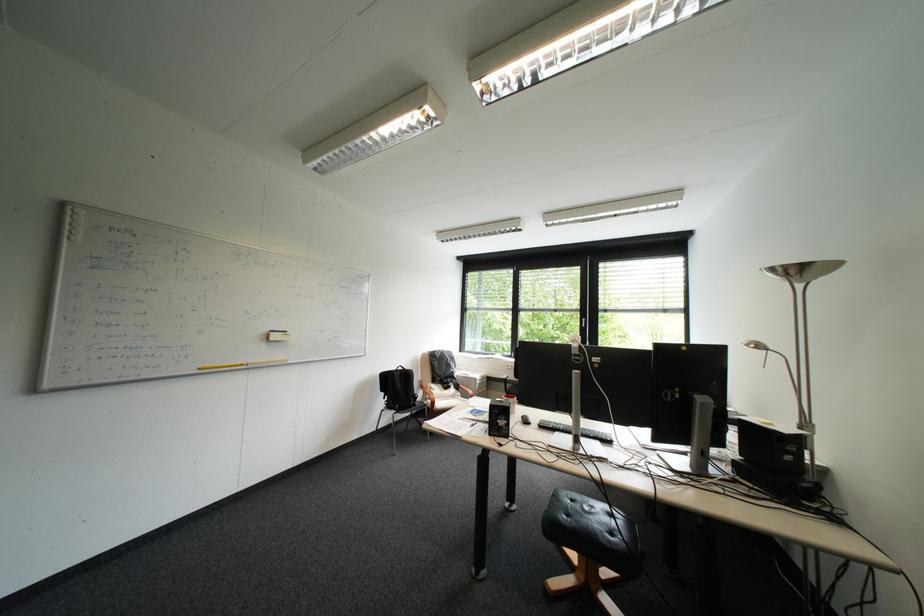
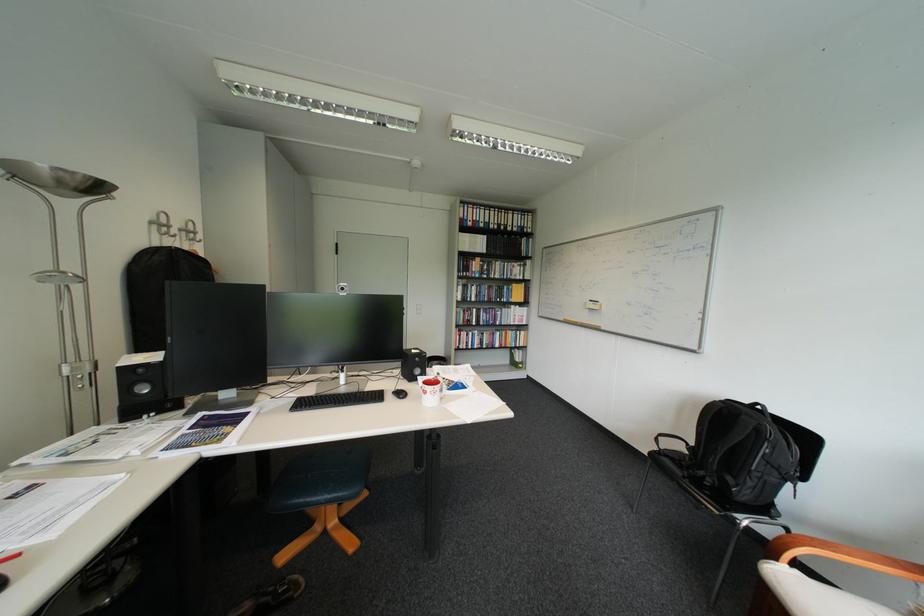
Locate, in the second image, the point that corresponds to (x=419, y=371) in the first image.

(756, 418)